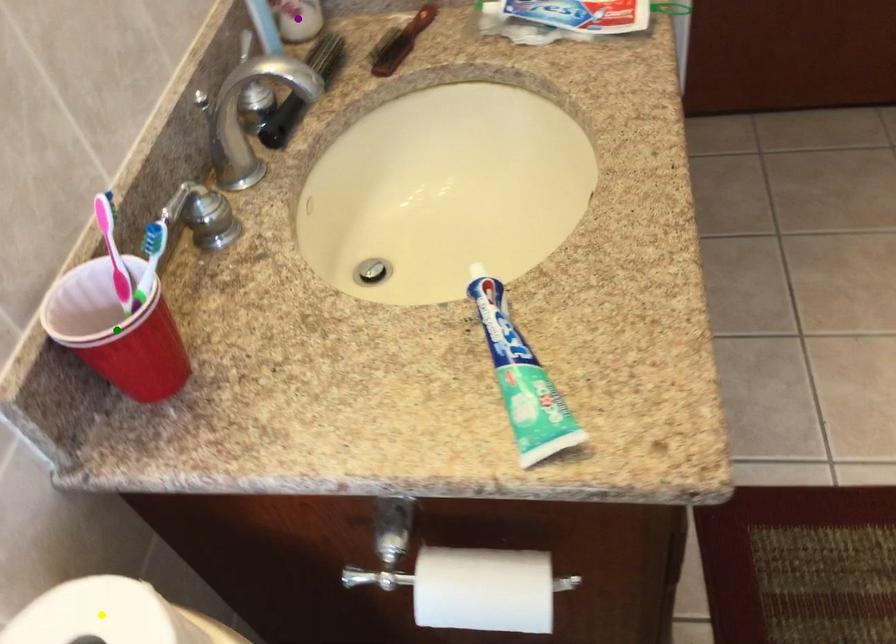
Order these from nearest to farthest:
yellow point
green point
purple point

yellow point, green point, purple point